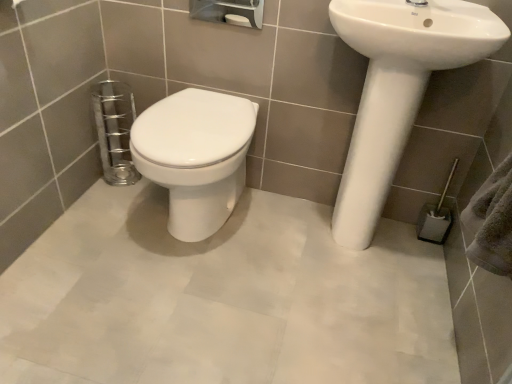
Question: From the image's perspective, is white glossy sink at right above white glossy sink at upper right?

Choices:
 (A) no
 (B) yes

Answer: (A)

Question: Is white glossy sink at right shorter than white glossy sink at upper right?

Choices:
 (A) no
 (B) yes

Answer: (A)

Question: Is white glossy sink at right thinner than white glossy sink at upper right?

Choices:
 (A) yes
 (B) no

Answer: (B)

Question: Is white glossy sink at upper right inside white glossy sink at right?

Choices:
 (A) yes
 (B) no

Answer: (B)

Question: Is white glossy sink at right at the right side of white glossy sink at upper right?

Choices:
 (A) no
 (B) yes

Answer: (A)

Question: From the image's perspective, is white glossy sink at right beneath white glossy sink at upper right?

Choices:
 (A) yes
 (B) no

Answer: (A)

Question: Could you tell me if white glossy sink at right is facing white glossy bidet at center?

Choices:
 (A) no
 (B) yes

Answer: (A)

Question: From a real-world perspective, is white glossy sink at right located higher than white glossy bidet at center?

Choices:
 (A) yes
 (B) no

Answer: (A)

Question: From the image's perspective, is white glossy sink at right under white glossy bidet at center?

Choices:
 (A) no
 (B) yes

Answer: (A)

Question: Is white glossy sink at right taller than white glossy bidet at center?

Choices:
 (A) yes
 (B) no

Answer: (A)

Question: Would you say white glossy sink at right is a long distance from white glossy bidet at center?

Choices:
 (A) no
 (B) yes

Answer: (A)

Question: From a real-world perspective, is white glossy sink at right below white glossy bidet at center?

Choices:
 (A) yes
 (B) no

Answer: (B)

Question: Is white glossy sink at right positioned far away from gray fabric towel bar at lower right?

Choices:
 (A) yes
 (B) no

Answer: (B)